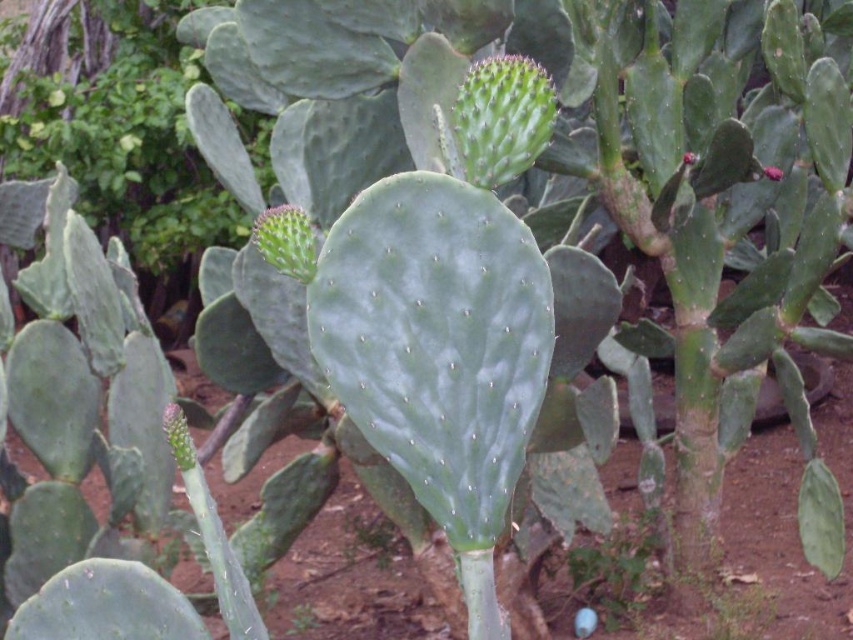
Question: Can you confirm if matte pink flower at center is thinner than smooth red flower at upper right?

Choices:
 (A) yes
 (B) no

Answer: (B)

Question: Does matte pink flower at center appear under smooth red flower at upper right?

Choices:
 (A) no
 (B) yes

Answer: (B)

Question: Can you confirm if matte pink flower at center is thinner than smooth red flower at upper right?

Choices:
 (A) no
 (B) yes

Answer: (A)

Question: Which point is closer to the camera?

Choices:
 (A) matte pink flower at center
 (B) smooth red flower at upper right

Answer: (B)

Question: Which of the following is the closest to the observer?

Choices:
 (A) (770, 176)
 (B) (682, 156)

Answer: (A)